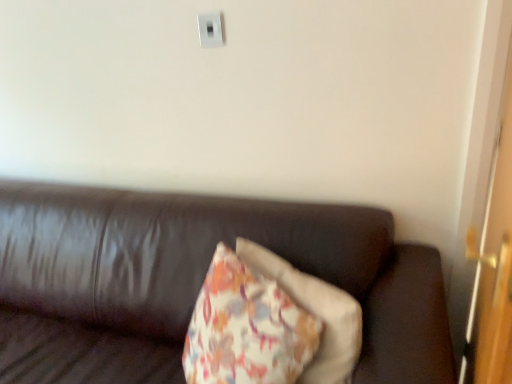
Question: Is wooden door at right looking in the opposite direction of leather couch at center?

Choices:
 (A) yes
 (B) no

Answer: (A)

Question: From the image's perspective, would you say wooden door at right is shown under leather couch at center?

Choices:
 (A) yes
 (B) no

Answer: (B)

Question: Can you confirm if wooden door at right is thinner than leather couch at center?

Choices:
 (A) yes
 (B) no

Answer: (A)

Question: Is wooden door at right bigger than leather couch at center?

Choices:
 (A) no
 (B) yes

Answer: (A)

Question: Is wooden door at right to the right of leather couch at center from the viewer's perspective?

Choices:
 (A) yes
 (B) no

Answer: (A)

Question: From a real-world perspective, is wooden door at right located beneath leather couch at center?

Choices:
 (A) yes
 (B) no

Answer: (B)

Question: Is white plastic switch at upper center positioned in front of leather couch at center?

Choices:
 (A) no
 (B) yes

Answer: (A)

Question: Can you confirm if white plastic switch at upper center is positioned to the right of leather couch at center?

Choices:
 (A) yes
 (B) no

Answer: (A)

Question: Is white plastic switch at upper center beside leather couch at center?

Choices:
 (A) no
 (B) yes

Answer: (A)

Question: From the image's perspective, does white plastic switch at upper center appear higher than leather couch at center?

Choices:
 (A) no
 (B) yes

Answer: (B)

Question: Considering the relative sizes of white plastic switch at upper center and leather couch at center in the image provided, is white plastic switch at upper center thinner than leather couch at center?

Choices:
 (A) yes
 (B) no

Answer: (A)

Question: Considering the relative positions of white plastic switch at upper center and leather couch at center in the image provided, is white plastic switch at upper center to the left of leather couch at center from the viewer's perspective?

Choices:
 (A) yes
 (B) no

Answer: (B)

Question: Considering the relative sizes of leather couch at center and white plastic switch at upper center in the image provided, is leather couch at center thinner than white plastic switch at upper center?

Choices:
 (A) no
 (B) yes

Answer: (A)